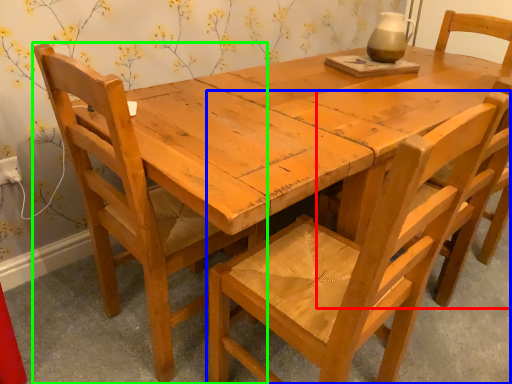
Question: Which object is the farthest from chair (highlighted by a red box)? Choose among these: chair (highlighted by a blue box) or chair (highlighted by a green box).

Choices:
 (A) chair
 (B) chair

Answer: (B)